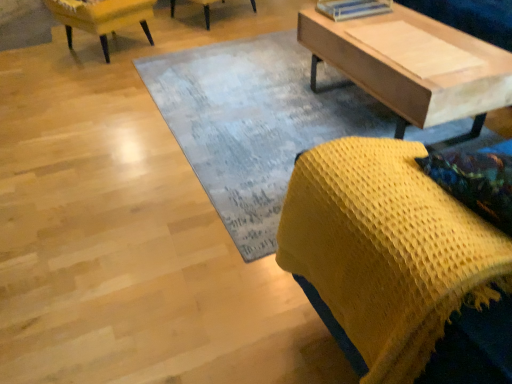
At what (x,y) coordinates should I click in order to perform the action: click on textured gray rug at center. Please return your answer as a coordinate pair (x, y). The height and width of the screenshot is (384, 512). Looking at the image, I should click on (253, 124).

At what (x,y) coordinates should I click in order to perform the action: click on yellow knitted blanket at lower right, the 2th chair positioned from the back. Please return your answer as a coordinate pair (x, y). The height and width of the screenshot is (384, 512). Looking at the image, I should click on (386, 252).

What do you see at coordinates (413, 70) in the screenshot? I see `light wood coffee table at upper right` at bounding box center [413, 70].

What is the approximate height of light brown wood plank at upper right?

It is 1.80 inches.

The height and width of the screenshot is (384, 512). Identify the location of textured gray rug at center. (253, 124).

From the image's perspective, relative to light brown wood plank at upper right, is light wood coffee table at upper right above or below?

light wood coffee table at upper right is situated lower than light brown wood plank at upper right in the image.

Considering the relative sizes of light wood coffee table at upper right and light brown wood plank at upper right in the image provided, is light wood coffee table at upper right thinner than light brown wood plank at upper right?

No.

Is light wood coffee table at upper right positioned with its back to light brown wood plank at upper right?

light wood coffee table at upper right is not turned away from light brown wood plank at upper right.

Based on the photo, from a real-world perspective, is light wood coffee table at upper right located beneath light brown wood plank at upper right?

Indeed, from a real-world perspective, light wood coffee table at upper right is positioned beneath light brown wood plank at upper right.

Considering the relative sizes of textured gray rug at center and yellow fabric chair at upper left, the first chair from the left, in the image provided, is textured gray rug at center bigger than yellow fabric chair at upper left, the first chair from the left,?

Actually, textured gray rug at center might be smaller than yellow fabric chair at upper left, the first chair from the left.

What's the angular difference between textured gray rug at center and yellow fabric chair at upper left, the first chair from the left,'s facing directions?

textured gray rug at center and yellow fabric chair at upper left, the first chair from the left, are facing 154 degrees away from each other.

Is textured gray rug at center positioned far away from yellow fabric chair at upper left, the second chair viewed from the right?

Absolutely, textured gray rug at center is distant from yellow fabric chair at upper left, the second chair viewed from the right.

From a real-world perspective, who is located lower, textured gray rug at center or yellow fabric chair at upper left, the second chair viewed from the right?

textured gray rug at center.

From the image's perspective, who appears lower, yellow knitted blanket at lower right, the 1th chair from the bottom, or light brown wood plank at upper right?

From the image's view, yellow knitted blanket at lower right, the 1th chair from the bottom, is below.

Are yellow knitted blanket at lower right, which appears as the 2th chair when viewed from the left, and light brown wood plank at upper right located far from each other?

yellow knitted blanket at lower right, which appears as the 2th chair when viewed from the left, is positioned a significant distance from light brown wood plank at upper right.

Which object is positioned more to the left, yellow knitted blanket at lower right, the 2th chair positioned from the back, or light brown wood plank at upper right?

yellow knitted blanket at lower right, the 2th chair positioned from the back.

Is the position of yellow knitted blanket at lower right, the first chair in the right-to-left sequence, less distant than that of light brown wood plank at upper right?

Yes, yellow knitted blanket at lower right, the first chair in the right-to-left sequence, is closer to the camera.

Between light brown wood plank at upper right and yellow knitted blanket at lower right, the 2th chair when ordered from top to bottom, which one appears on the right side from the viewer's perspective?

From the viewer's perspective, light brown wood plank at upper right appears more on the right side.

Is light brown wood plank at upper right positioned with its back to yellow knitted blanket at lower right, the first chair in the right-to-left sequence?

No, light brown wood plank at upper right is not facing away from yellow knitted blanket at lower right, the first chair in the right-to-left sequence.

Considering the relative sizes of light brown wood plank at upper right and yellow knitted blanket at lower right, the 2th chair when ordered from top to bottom, in the image provided, is light brown wood plank at upper right smaller than yellow knitted blanket at lower right, the 2th chair when ordered from top to bottom,?

Yes, light brown wood plank at upper right is smaller than yellow knitted blanket at lower right, the 2th chair when ordered from top to bottom.

You are a GUI agent. You are given a task and a screenshot of the screen. Output one action in this format:
    pyautogui.click(x=<x>, y=<y>)
    Task: Click on the plank behind the yellow knitted blanket at lower right, which appears as the 2th chair when viewed from the left
    The image size is (512, 384).
    Given the screenshot: What is the action you would take?
    pyautogui.click(x=414, y=49)

Find the location of a particular element. The image size is (512, 384). plank on the right side of yellow fabric chair at upper left, arranged as the first chair when viewed from the back is located at coordinates (414, 49).

Is yellow fabric chair at upper left, arranged as the first chair when viewed from the back, oriented away from light brown wood plank at upper right?

yellow fabric chair at upper left, arranged as the first chair when viewed from the back, is not turned away from light brown wood plank at upper right.

Considering the relative positions of yellow fabric chair at upper left, the second chair viewed from the right, and light brown wood plank at upper right in the image provided, is yellow fabric chair at upper left, the second chair viewed from the right, to the left of light brown wood plank at upper right from the viewer's perspective?

Correct, you'll find yellow fabric chair at upper left, the second chair viewed from the right, to the left of light brown wood plank at upper right.

From a real-world perspective, is yellow fabric chair at upper left, the second chair viewed from the right, physically located above or below light brown wood plank at upper right?

From a real-world perspective, yellow fabric chair at upper left, the second chair viewed from the right, is physically below light brown wood plank at upper right.

Can you confirm if light wood coffee table at upper right is positioned to the left of yellow fabric chair at upper left, arranged as the first chair when viewed from the back?

In fact, light wood coffee table at upper right is to the right of yellow fabric chair at upper left, arranged as the first chair when viewed from the back.

Is light wood coffee table at upper right taller or shorter than yellow fabric chair at upper left, the first chair from the left?

Clearly, light wood coffee table at upper right is taller compared to yellow fabric chair at upper left, the first chair from the left.

Consider the image. Can you confirm if light wood coffee table at upper right is bigger than yellow fabric chair at upper left, which is the second chair in front-to-back order?

Indeed, light wood coffee table at upper right has a larger size compared to yellow fabric chair at upper left, which is the second chair in front-to-back order.

Which point is more distant from viewer, (274, 146) or (280, 249)?

Positioned behind is point (274, 146).

Is textured gray rug at center oriented away from yellow knitted blanket at lower right, which appears as the 2th chair when viewed from the left?

No, textured gray rug at center is not facing away from yellow knitted blanket at lower right, which appears as the 2th chair when viewed from the left.

Which object is thinner, textured gray rug at center or yellow knitted blanket at lower right, the first chair in the right-to-left sequence?

yellow knitted blanket at lower right, the first chair in the right-to-left sequence.

Is textured gray rug at center directly adjacent to yellow knitted blanket at lower right, arranged as the 1th chair when viewed from the front?

textured gray rug at center and yellow knitted blanket at lower right, arranged as the 1th chair when viewed from the front, are clearly separated.

Image resolution: width=512 pixels, height=384 pixels. I want to click on coffee table below the light brown wood plank at upper right (from the image's perspective), so click(413, 70).

In order to click on mat in front of the yellow fabric chair at upper left, arranged as the first chair when viewed from the back in this screenshot , I will do `click(253, 124)`.

When comparing their distances from light brown wood plank at upper right, does light wood coffee table at upper right or textured gray rug at center seem further?

textured gray rug at center.

Looking at the image, which one is located further to yellow fabric chair at upper left, which is the second chair in front-to-back order, textured gray rug at center or light wood coffee table at upper right?

light wood coffee table at upper right lies further to yellow fabric chair at upper left, which is the second chair in front-to-back order, than the other object.

When comparing their distances from textured gray rug at center, does light brown wood plank at upper right or yellow knitted blanket at lower right, the 2th chair positioned from the back, seem closer?

light brown wood plank at upper right is closer to textured gray rug at center.

Looking at this image, which object lies nearer to the anchor point light brown wood plank at upper right, yellow knitted blanket at lower right, which appears as the 2th chair when viewed from the left, or textured gray rug at center?

The object closer to light brown wood plank at upper right is textured gray rug at center.

When comparing their distances from light brown wood plank at upper right, does yellow knitted blanket at lower right, which appears as the 2th chair when viewed from the left, or light wood coffee table at upper right seem further?

Based on the image, yellow knitted blanket at lower right, which appears as the 2th chair when viewed from the left, appears to be further to light brown wood plank at upper right.

Looking at the image, which one is located further to textured gray rug at center, light brown wood plank at upper right or light wood coffee table at upper right?

light brown wood plank at upper right is further to textured gray rug at center.

From the image, which object appears to be nearer to yellow knitted blanket at lower right, the 2th chair when ordered from top to bottom, light brown wood plank at upper right or light wood coffee table at upper right?

Among the two, light wood coffee table at upper right is located nearer to yellow knitted blanket at lower right, the 2th chair when ordered from top to bottom.

Which object lies further to the anchor point light brown wood plank at upper right, textured gray rug at center or yellow fabric chair at upper left, the second chair viewed from the right?

yellow fabric chair at upper left, the second chair viewed from the right, is positioned further to the anchor light brown wood plank at upper right.

This screenshot has height=384, width=512. I want to click on coffee table positioned between yellow knitted blanket at lower right, the 2th chair positioned from the back, and yellow fabric chair at upper left, the second chair viewed from the right, from near to far, so click(x=413, y=70).

The height and width of the screenshot is (384, 512). Find the location of `coffee table between yellow knitted blanket at lower right, arranged as the 1th chair when viewed from the front, and light brown wood plank at upper right from front to back`. coffee table between yellow knitted blanket at lower right, arranged as the 1th chair when viewed from the front, and light brown wood plank at upper right from front to back is located at coordinates pyautogui.click(x=413, y=70).

This screenshot has width=512, height=384. Identify the location of mat between yellow knitted blanket at lower right, arranged as the 1th chair when viewed from the front, and light brown wood plank at upper right from front to back. (253, 124).

Identify the location of mat located between yellow fabric chair at upper left, which is the first chair in top-to-bottom order, and light brown wood plank at upper right in the left-right direction. (253, 124).